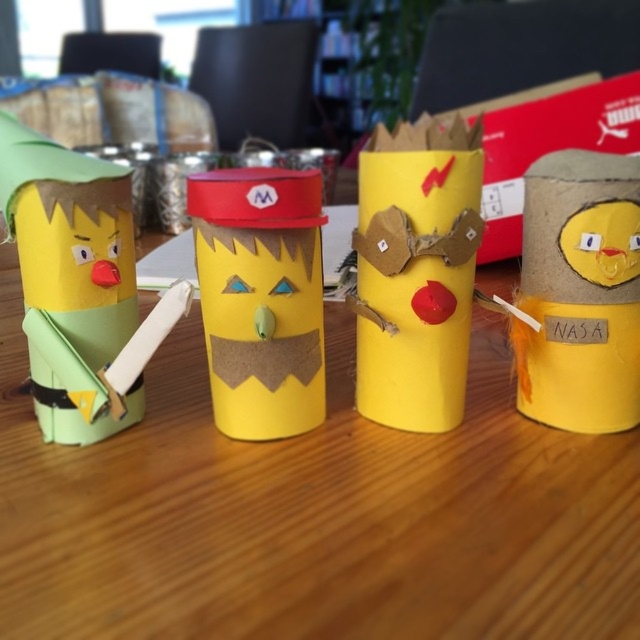
Between yellow cardboard tubes at center and yellow cardboard tube at right, which one is positioned higher?

Positioned higher is yellow cardboard tubes at center.

Is point (26, 552) behind point (595, 273)?

No.

You are a GUI agent. You are given a task and a screenshot of the screen. Output one action in this format:
    pyautogui.click(x=<x>, y=<y>)
    Task: Click on the yellow cardboard tubes at center
    This screenshot has width=640, height=640.
    Given the screenshot: What is the action you would take?
    pyautogui.click(x=310, y=513)

Can you confirm if yellow cardboard cup at center is taller than yellow cardboard tube at right?

In fact, yellow cardboard cup at center may be shorter than yellow cardboard tube at right.

Consider the image. Does yellow cardboard cup at center have a larger size compared to yellow cardboard tube at right?

Correct, yellow cardboard cup at center is larger in size than yellow cardboard tube at right.

Measure the distance between yellow cardboard cup at center and camera.

They are 25.48 inches apart.

Where is `yellow cardboard cup at center`? The height and width of the screenshot is (640, 640). yellow cardboard cup at center is located at coordinates (260, 298).

Is yellow cardboard tubes at center thinner than yellow cardboard cup at center?

In fact, yellow cardboard tubes at center might be wider than yellow cardboard cup at center.

Based on the photo, does yellow cardboard tubes at center have a smaller size compared to yellow cardboard cup at center?

Actually, yellow cardboard tubes at center might be larger than yellow cardboard cup at center.

Which is in front, point (384, 476) or point (188, 208)?

Positioned in front is point (384, 476).

Image resolution: width=640 pixels, height=640 pixels. I want to click on yellow cardboard tubes at center, so click(310, 513).